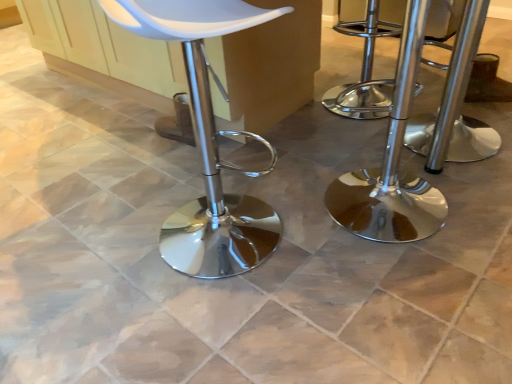
Where is `unoccupied space behind white matte stool at center`? unoccupied space behind white matte stool at center is located at coordinates (218, 174).